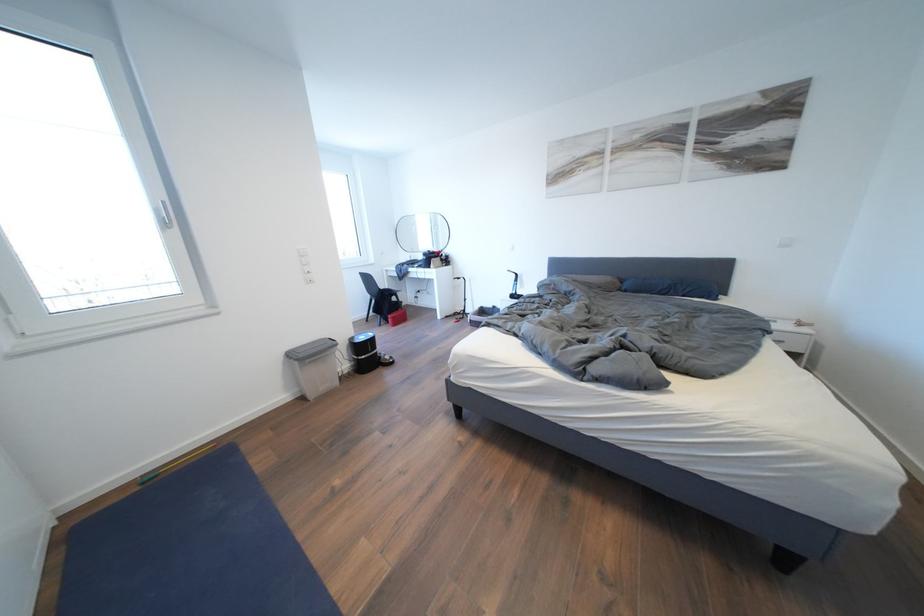
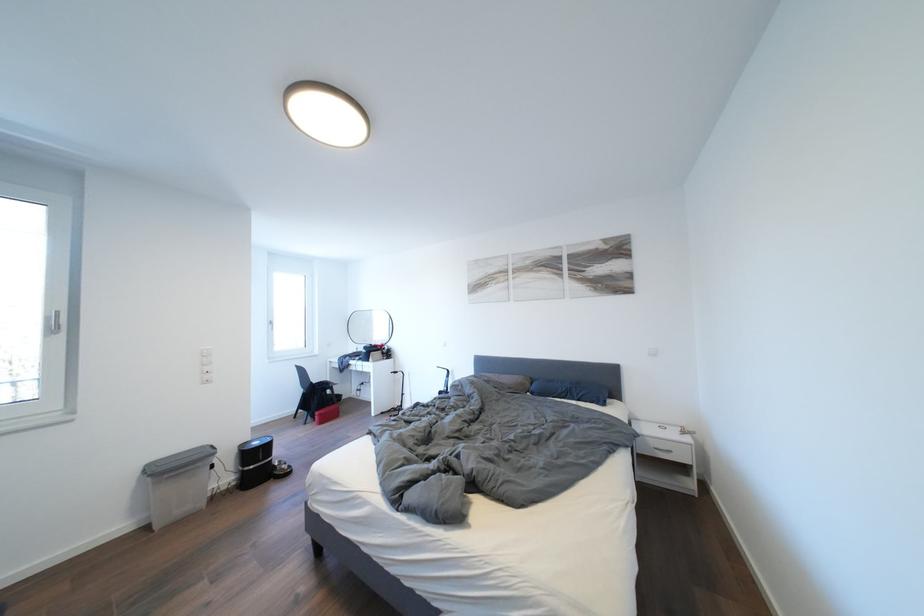
Question: I am providing you with two images of the same scene from different viewpoints. After the viewpoint changes to image2, which objects are now occluded?

Choices:
 (A) blue pillow
 (B) white light switch
 (C) grey bin handle
 (D) none of these

Answer: (D)